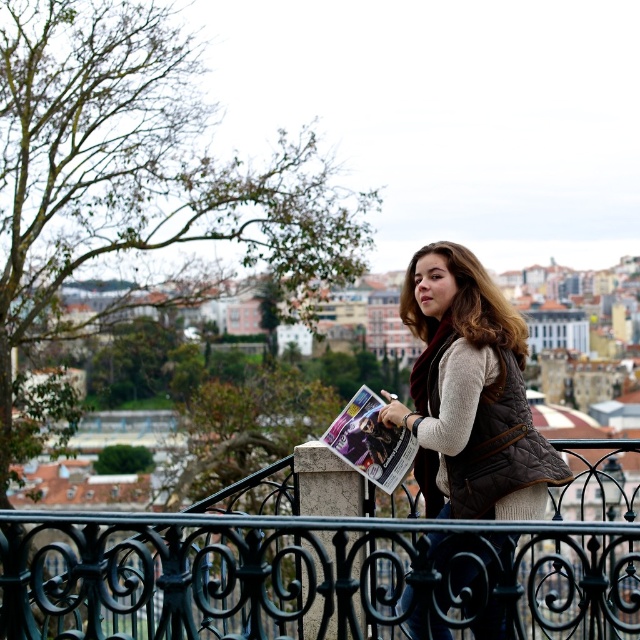
You are a tailor trying to determine if a brown quilted vest at center can fit into a storage box designed for matte paper magazine at center. Based on their sizes, can the vest fit into the box?

The brown quilted vest at center might be wider than matte paper magazine at center, so it may not fit into the box designed for the magazine.

You are a photographer trying to capture a clear shot of both the brown quilted vest at center and the matte paper magazine at center. Given their distance apart, will you need to adjust your camera settings to ensure both are in focus?

The brown quilted vest at center and matte paper magazine at center are 22.74 meters apart. To ensure both are in focus, you should adjust your camera settings to a smaller aperture for a deeper depth of field.

You are a photographer aiming to capture the black wrought iron fence at center and the matte paper magazine at center in a single shot. Which object should you adjust your camera to focus on first if you want to ensure both are in frame?

The black wrought iron fence at center is positioned on the left side of matte paper magazine at center. To ensure both are in frame, focus on the black wrought iron fence at center first as it is closer to the left edge, then adjust the camera to include the matte paper magazine at center on the right side.